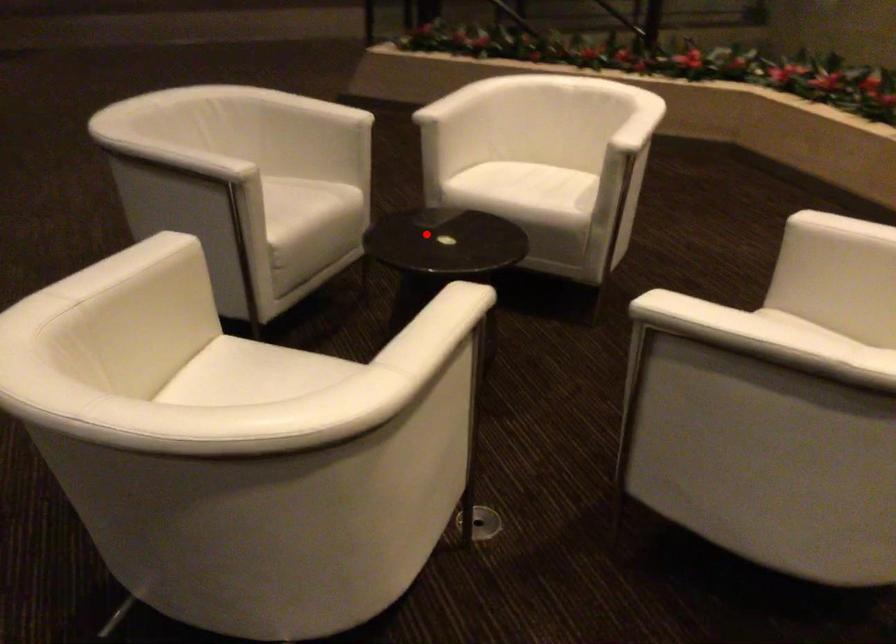
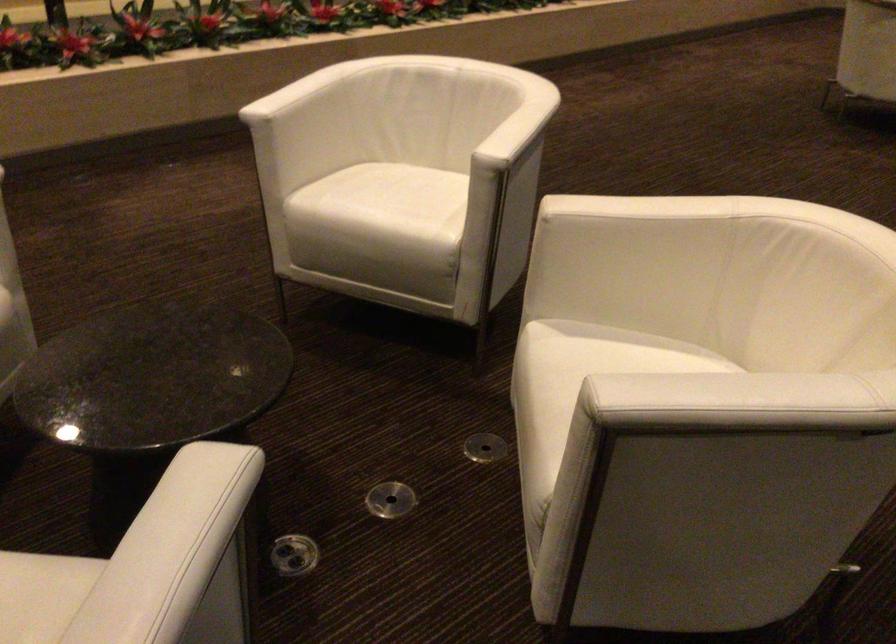
Where in the second image is the point corresponding to the highlighted location from the first image?

(152, 377)